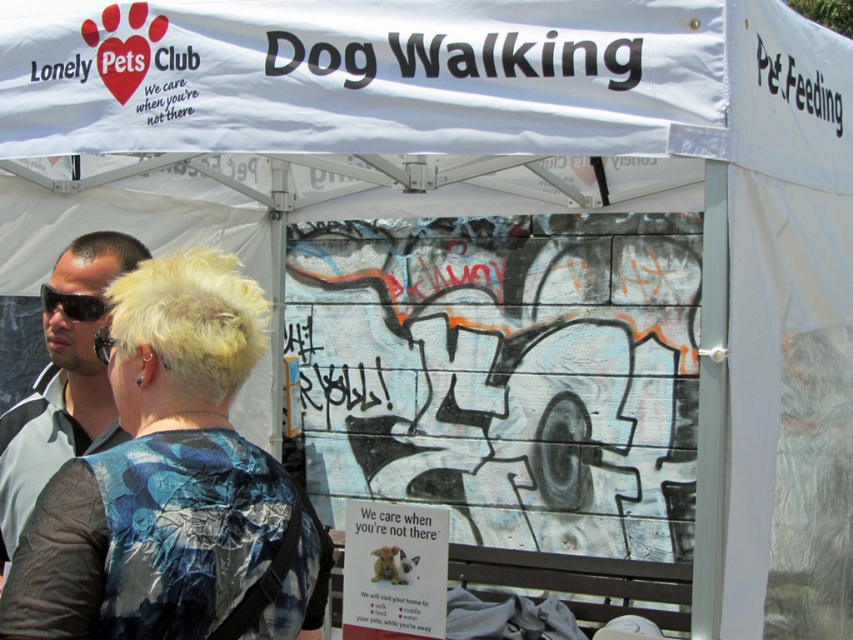
Question: Can you confirm if gray fabric shirt at left is smaller than black plastic sunglasses at left?

Choices:
 (A) yes
 (B) no

Answer: (B)

Question: Which of the following is the closest to the observer?

Choices:
 (A) gray fabric shirt at left
 (B) black paper sign at upper center

Answer: (B)

Question: Which point is farther to the camera?

Choices:
 (A) black paper sign at upper center
 (B) gray fabric shirt at left
 (C) black plastic sign at upper right

Answer: (B)

Question: Based on their relative distances, which object is nearer to the gray fabric shirt at left?

Choices:
 (A) black plastic sunglasses at left
 (B) black paper sign at upper center
 (C) black plastic sign at upper right

Answer: (A)

Question: Is gray fabric shirt at left smaller than black plastic sign at upper right?

Choices:
 (A) no
 (B) yes

Answer: (A)

Question: Does gray fabric shirt at left have a lesser width compared to black paper sign at upper center?

Choices:
 (A) yes
 (B) no

Answer: (A)